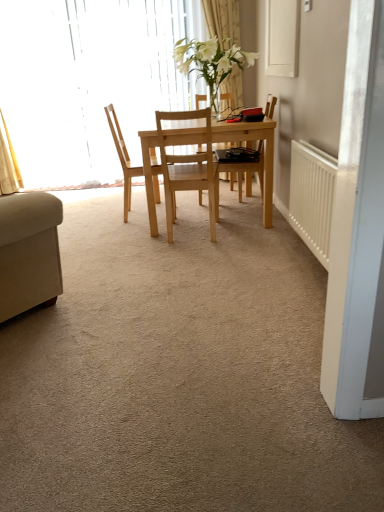
Identify the location of vacant space in front of natural wood chair at center, arranged as the 2th chair when viewed from the left. (200, 252).